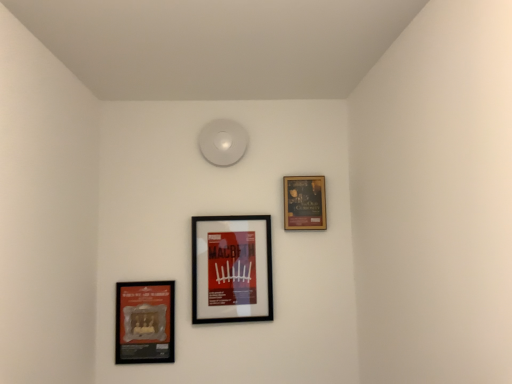
At what (x,y) coordinates should I click in order to perform the action: click on wooden frame at upper right, acting as the first picture frame starting from the right. Please return your answer as a coordinate pair (x, y). Looking at the image, I should click on (304, 203).

At what (x,y) coordinates should I click in order to perform the action: click on matte black picture frame at lower left, the first picture frame when ordered from left to right. Please return your answer as a coordinate pair (x, y). Looking at the image, I should click on (145, 322).

Image resolution: width=512 pixels, height=384 pixels. In order to click on wooden frame at upper right, acting as the first picture frame starting from the right in this screenshot , I will do `click(304, 203)`.

Considering the relative sizes of wooden frame at upper right, acting as the first picture frame starting from the right, and black matte picture frame at center, the 2th picture frame from the left, in the image provided, is wooden frame at upper right, acting as the first picture frame starting from the right, wider than black matte picture frame at center, the 2th picture frame from the left,?

Incorrect, the width of wooden frame at upper right, acting as the first picture frame starting from the right, does not surpass that of black matte picture frame at center, the 2th picture frame from the left.

Is wooden frame at upper right, marked as the third picture frame in a left-to-right arrangement, in contact with black matte picture frame at center, the second picture frame from the right?

No, wooden frame at upper right, marked as the third picture frame in a left-to-right arrangement, is not next to black matte picture frame at center, the second picture frame from the right.

From the image's perspective, between wooden frame at upper right, acting as the first picture frame starting from the right, and black matte picture frame at center, the second picture frame from the right, who is located below?

black matte picture frame at center, the second picture frame from the right, appears lower in the image.

Considering the positions of points (284, 219) and (258, 298), is point (284, 219) closer to camera compared to point (258, 298)?

That is False.

Is black matte picture frame at center, the 2th picture frame from the left, positioned far away from matte black picture frame at lower left, the first picture frame when ordered from left to right?

black matte picture frame at center, the 2th picture frame from the left, is near matte black picture frame at lower left, the first picture frame when ordered from left to right, not far away.

In the image, is black matte picture frame at center, the 2th picture frame from the left, positioned in front of or behind matte black picture frame at lower left, the first picture frame when ordered from left to right?

black matte picture frame at center, the 2th picture frame from the left, is behind matte black picture frame at lower left, the first picture frame when ordered from left to right.

Which object is positioned more to the left, black matte picture frame at center, the 2th picture frame from the left, or matte black picture frame at lower left, positioned as the 3th picture frame in right-to-left order?

matte black picture frame at lower left, positioned as the 3th picture frame in right-to-left order.

Does black matte picture frame at center, the 2th picture frame from the left, turn towards matte black picture frame at lower left, the first picture frame when ordered from left to right?

No, black matte picture frame at center, the 2th picture frame from the left, is not facing towards matte black picture frame at lower left, the first picture frame when ordered from left to right.

Does matte black picture frame at lower left, the first picture frame when ordered from left to right, have a lesser height compared to wooden frame at upper right, marked as the third picture frame in a left-to-right arrangement?

In fact, matte black picture frame at lower left, the first picture frame when ordered from left to right, may be taller than wooden frame at upper right, marked as the third picture frame in a left-to-right arrangement.

From the image's perspective, which is above, matte black picture frame at lower left, positioned as the 3th picture frame in right-to-left order, or wooden frame at upper right, acting as the first picture frame starting from the right?

wooden frame at upper right, acting as the first picture frame starting from the right, appears higher in the image.

Can you tell me how much matte black picture frame at lower left, the first picture frame when ordered from left to right, and wooden frame at upper right, marked as the third picture frame in a left-to-right arrangement, differ in facing direction?

The angle between the facing direction of matte black picture frame at lower left, the first picture frame when ordered from left to right, and the facing direction of wooden frame at upper right, marked as the third picture frame in a left-to-right arrangement, is 0.641 degrees.

From the picture: Does matte black picture frame at lower left, the first picture frame when ordered from left to right, turn towards wooden frame at upper right, marked as the third picture frame in a left-to-right arrangement?

No, matte black picture frame at lower left, the first picture frame when ordered from left to right, is not facing towards wooden frame at upper right, marked as the third picture frame in a left-to-right arrangement.

Can you confirm if matte black picture frame at lower left, positioned as the 3th picture frame in right-to-left order, is bigger than black matte picture frame at center, the 2th picture frame from the left?

Incorrect, matte black picture frame at lower left, positioned as the 3th picture frame in right-to-left order, is not larger than black matte picture frame at center, the 2th picture frame from the left.

Is matte black picture frame at lower left, positioned as the 3th picture frame in right-to-left order, next to black matte picture frame at center, the second picture frame from the right, and touching it?

No.

Is matte black picture frame at lower left, positioned as the 3th picture frame in right-to-left order, aimed at black matte picture frame at center, the 2th picture frame from the left?

No, matte black picture frame at lower left, positioned as the 3th picture frame in right-to-left order, is not turned towards black matte picture frame at center, the 2th picture frame from the left.

Starting from the matte black picture frame at lower left, the first picture frame when ordered from left to right, which picture frame is the 1st one behind? Please provide its 2D coordinates.

[(231, 269)]

Is point (295, 213) closer to viewer compared to point (126, 351)?

No, (295, 213) is behind (126, 351).

Identify the location of picture frame that is the 2nd object to the right of the matte black picture frame at lower left, positioned as the 3th picture frame in right-to-left order, starting at the anchor. (304, 203).

In the scene shown: Between wooden frame at upper right, acting as the first picture frame starting from the right, and matte black picture frame at lower left, positioned as the 3th picture frame in right-to-left order, which one has smaller size?

With smaller size is wooden frame at upper right, acting as the first picture frame starting from the right.

From the picture: Is black matte picture frame at center, the second picture frame from the right, not close to wooden frame at upper right, marked as the third picture frame in a left-to-right arrangement?

No, black matte picture frame at center, the second picture frame from the right, is not far from wooden frame at upper right, marked as the third picture frame in a left-to-right arrangement.

The width and height of the screenshot is (512, 384). What are the coordinates of `the 1st picture frame positioned below the wooden frame at upper right, marked as the third picture frame in a left-to-right arrangement (from a real-world perspective)` in the screenshot? It's located at (231, 269).

Is the depth of black matte picture frame at center, the 2th picture frame from the left, less than that of wooden frame at upper right, marked as the third picture frame in a left-to-right arrangement?

That is True.

How different are the orientations of black matte picture frame at center, the 2th picture frame from the left, and wooden frame at upper right, marked as the third picture frame in a left-to-right arrangement, in degrees?

black matte picture frame at center, the 2th picture frame from the left, and wooden frame at upper right, marked as the third picture frame in a left-to-right arrangement, are facing 2.95 degrees away from each other.

At what (x,y) coordinates should I click in order to perform the action: click on the 1st picture frame below the wooden frame at upper right, marked as the third picture frame in a left-to-right arrangement (from a real-world perspective). Please return your answer as a coordinate pair (x, y). Looking at the image, I should click on (231, 269).

Locate an element on the screen. The width and height of the screenshot is (512, 384). the 1st picture frame counting from the right of the matte black picture frame at lower left, positioned as the 3th picture frame in right-to-left order is located at coordinates (231, 269).

Which object lies nearer to the anchor point black matte picture frame at center, the 2th picture frame from the left, matte black picture frame at lower left, positioned as the 3th picture frame in right-to-left order, or wooden frame at upper right, acting as the first picture frame starting from the right?

matte black picture frame at lower left, positioned as the 3th picture frame in right-to-left order, is closer to black matte picture frame at center, the 2th picture frame from the left.

When comparing their distances from wooden frame at upper right, acting as the first picture frame starting from the right, does matte black picture frame at lower left, the first picture frame when ordered from left to right, or black matte picture frame at center, the 2th picture frame from the left, seem closer?

black matte picture frame at center, the 2th picture frame from the left, lies closer to wooden frame at upper right, acting as the first picture frame starting from the right, than the other object.

Based on their spatial positions, is black matte picture frame at center, the second picture frame from the right, or wooden frame at upper right, marked as the third picture frame in a left-to-right arrangement, closer to matte black picture frame at lower left, positioned as the 3th picture frame in right-to-left order?

black matte picture frame at center, the second picture frame from the right.

When comparing their distances from black matte picture frame at center, the second picture frame from the right, does wooden frame at upper right, acting as the first picture frame starting from the right, or matte black picture frame at lower left, the first picture frame when ordered from left to right, seem further?

The object further to black matte picture frame at center, the second picture frame from the right, is wooden frame at upper right, acting as the first picture frame starting from the right.

Consider the image. When comparing their distances from matte black picture frame at lower left, the first picture frame when ordered from left to right, does wooden frame at upper right, acting as the first picture frame starting from the right, or black matte picture frame at center, the 2th picture frame from the left, seem closer?

Based on the image, black matte picture frame at center, the 2th picture frame from the left, appears to be nearer to matte black picture frame at lower left, the first picture frame when ordered from left to right.

When comparing their distances from wooden frame at upper right, acting as the first picture frame starting from the right, does black matte picture frame at center, the 2th picture frame from the left, or matte black picture frame at lower left, positioned as the 3th picture frame in right-to-left order, seem further?

The object further to wooden frame at upper right, acting as the first picture frame starting from the right, is matte black picture frame at lower left, positioned as the 3th picture frame in right-to-left order.

What are the coordinates of `picture frame between matte black picture frame at lower left, the first picture frame when ordered from left to right, and wooden frame at upper right, marked as the third picture frame in a left-to-right arrangement, in the horizontal direction` in the screenshot? It's located at (231, 269).